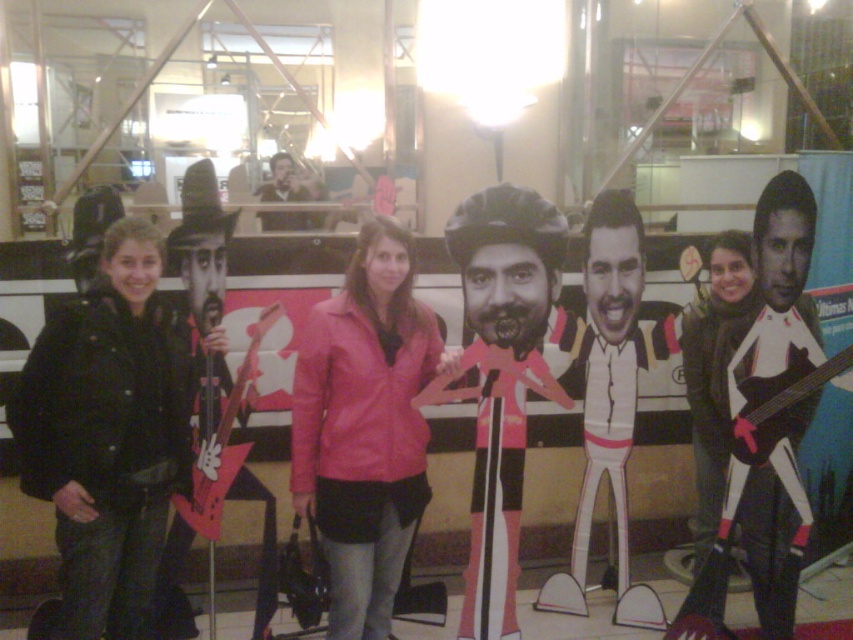
In the scene shown: Who is more forward, (x=465, y=273) or (x=782, y=621)?

Point (x=465, y=273)

Is pink cardboard man at center smaller than white matte guitar at right?

Yes, pink cardboard man at center is smaller than white matte guitar at right.

Image resolution: width=853 pixels, height=640 pixels. Find the location of `pink cardboard man at center`. pink cardboard man at center is located at coordinates (500, 378).

Between point (113, 528) and point (474, 208), which one is positioned in front?

Point (113, 528) is more forward.

Is point (125, 525) farther from camera compared to point (527, 340)?

No, it is not.

Between point (96, 604) and point (518, 634), which one is positioned behind?

Point (518, 634)

The height and width of the screenshot is (640, 853). I want to click on black leather jacket at left, so click(107, 436).

Is black leather jacket at left to the left of white matte guitar at right from the viewer's perspective?

Correct, you'll find black leather jacket at left to the left of white matte guitar at right.

Between point (85, 541) and point (732, 390), which one is positioned in front?

Positioned in front is point (85, 541).

Image resolution: width=853 pixels, height=640 pixels. I want to click on black leather jacket at left, so click(x=107, y=436).